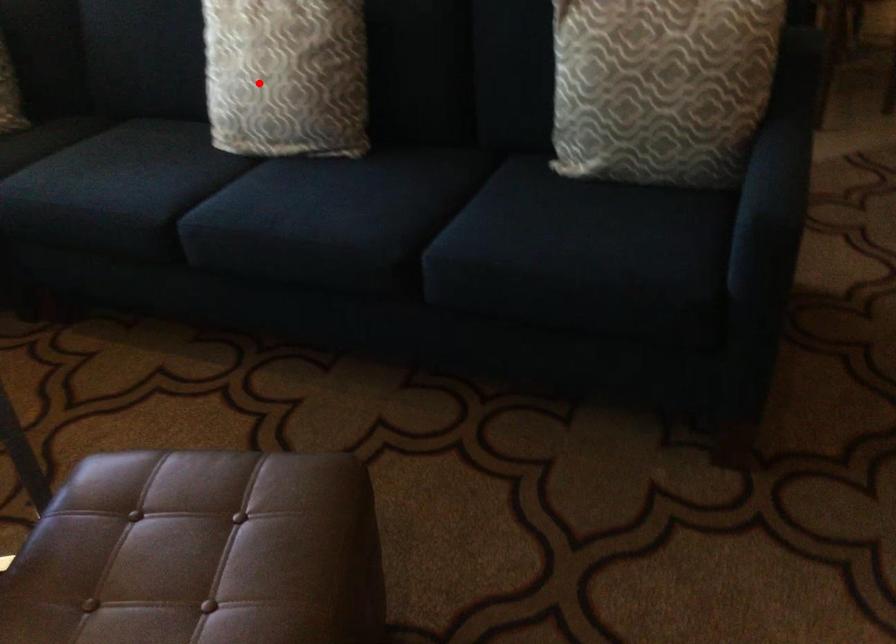
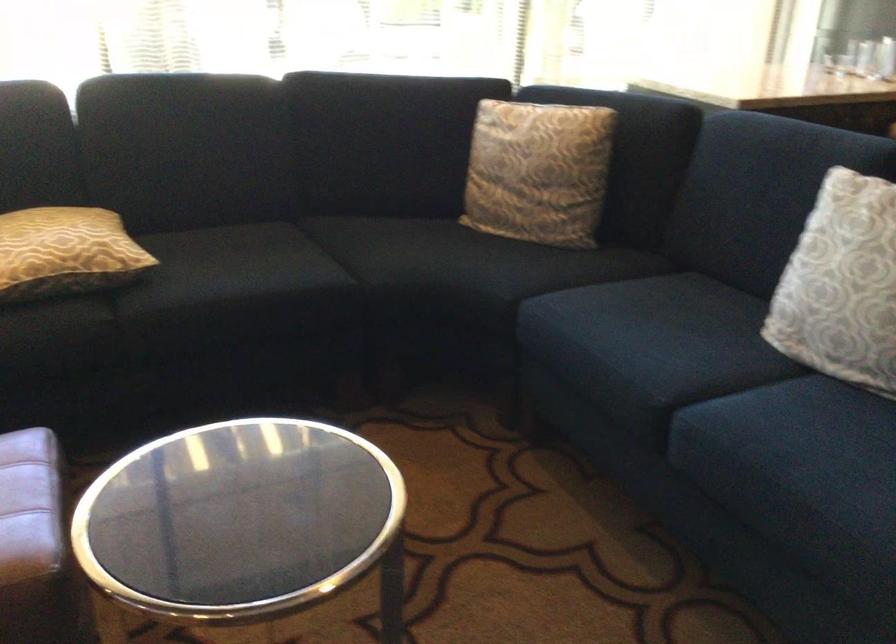
Question: I am providing you with two images of the same scene from different viewpoints. Given a red point in image1, look at the same physical point in image2. Is it:

Choices:
 (A) Closer to the viewpoint
 (B) Farther from the viewpoint

Answer: (A)